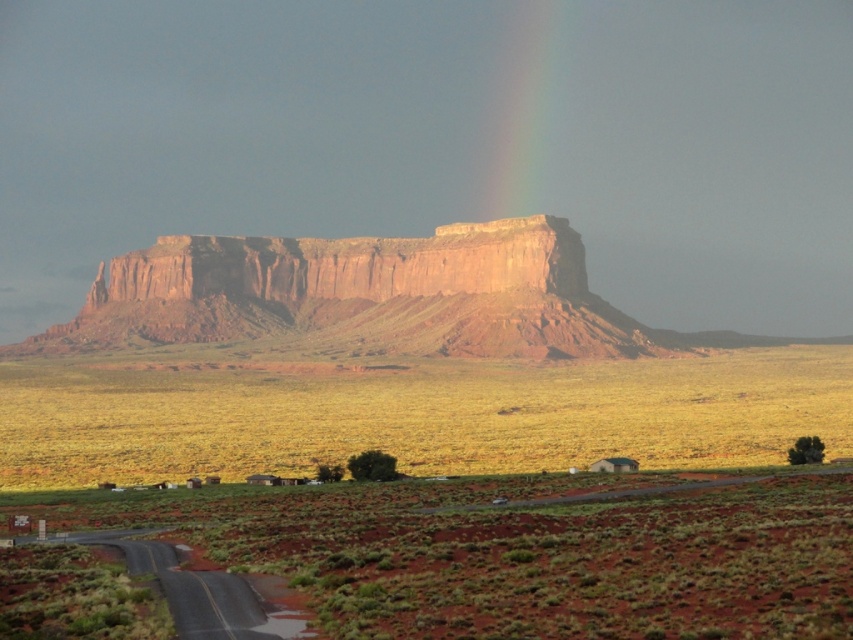
Is rustic sandstone mesa at center wider than rainbow translucent at upper center?

Yes, rustic sandstone mesa at center is wider than rainbow translucent at upper center.

Is rustic sandstone mesa at center shorter than rainbow translucent at upper center?

Correct, rustic sandstone mesa at center is not as tall as rainbow translucent at upper center.

Who is more forward, (585, 340) or (558, 20)?

Positioned in front is point (585, 340).

Image resolution: width=853 pixels, height=640 pixels. I want to click on rustic sandstone mesa at center, so click(x=363, y=296).

How distant is yellow grassland at lower center from rustic sandstone mesa at center?

A distance of 48.09 meters exists between yellow grassland at lower center and rustic sandstone mesa at center.

You are a GUI agent. You are given a task and a screenshot of the screen. Output one action in this format:
    pyautogui.click(x=<x>, y=<y>)
    Task: Click on the yellow grassland at lower center
    Image resolution: width=853 pixels, height=640 pixels.
    Given the screenshot: What is the action you would take?
    pyautogui.click(x=415, y=413)

Can you confirm if yellow grassland at lower center is wider than rainbow translucent at upper center?

Correct, the width of yellow grassland at lower center exceeds that of rainbow translucent at upper center.

Does yellow grassland at lower center have a greater height compared to rainbow translucent at upper center?

No.

Between point (769, 362) and point (485, 212), which one is positioned in front?

Positioned in front is point (769, 362).

Identify the location of yellow grassland at lower center. (415, 413).